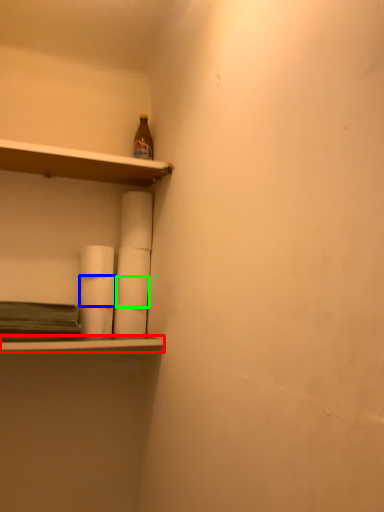
Question: Considering the real-world distances, which object is closest to ledge (highlighted by a red box)? paper towel (highlighted by a blue box) or paper towel (highlighted by a green box).

Choices:
 (A) paper towel
 (B) paper towel

Answer: (A)